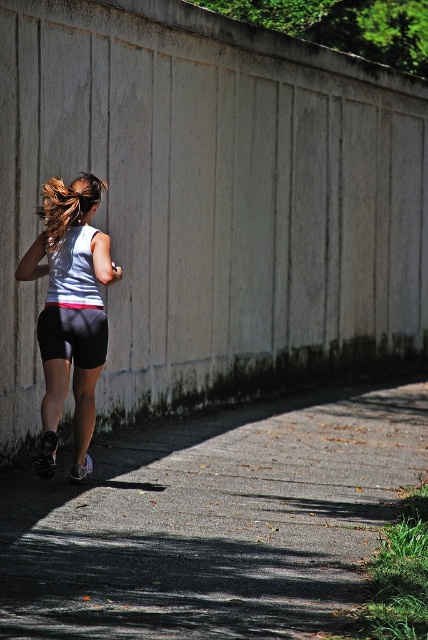
Question: Which point is farther to the camera?

Choices:
 (A) blonde hair at back
 (B) gray matte shorts at center

Answer: (B)

Question: Is white matte shorts at center wider than blonde hair at back?

Choices:
 (A) no
 (B) yes

Answer: (B)

Question: Does white matte shorts at center have a larger size compared to blonde hair at back?

Choices:
 (A) no
 (B) yes

Answer: (B)

Question: Which of the following is the farthest from the observer?

Choices:
 (A) (64, 225)
 (B) (269, 520)

Answer: (A)

Question: Considering the real-world distances, which object is farthest from the blonde hair at back?

Choices:
 (A) gray matte shorts at center
 (B) white matte shorts at center

Answer: (A)

Question: From the image, what is the correct spatial relationship of gray matte shorts at center in relation to blonde hair at back?

Choices:
 (A) left
 (B) right

Answer: (B)